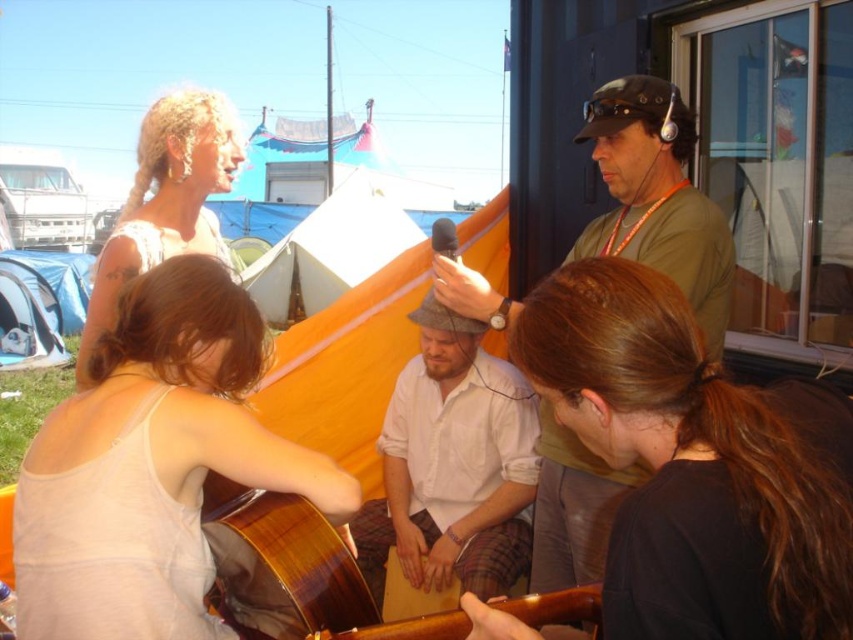
Between green matte shirt at upper right and wooden guitar at center, which one is positioned higher?

green matte shirt at upper right is higher up.

The width and height of the screenshot is (853, 640). Describe the element at coordinates (656, 196) in the screenshot. I see `green matte shirt at upper right` at that location.

You are a GUI agent. You are given a task and a screenshot of the screen. Output one action in this format:
    pyautogui.click(x=<x>, y=<y>)
    Task: Click on the green matte shirt at upper right
    
    Given the screenshot: What is the action you would take?
    pyautogui.click(x=656, y=196)

Which is more to the left, brown hair at center or green matte shirt at upper right?

From the viewer's perspective, brown hair at center appears more on the left side.

Can you confirm if brown hair at center is wider than green matte shirt at upper right?

Yes.

Is point (602, 397) behind point (648, 120)?

No, (602, 397) is in front of (648, 120).

In order to click on brown hair at center in this screenshot , I will do `click(688, 467)`.

Is blonde hair at upper left closer to camera compared to wooden guitar at center?

No, blonde hair at upper left is behind wooden guitar at center.

Can you confirm if blonde hair at upper left is thinner than wooden guitar at center?

Yes.

Identify the location of blonde hair at upper left. This screenshot has height=640, width=853. (165, 202).